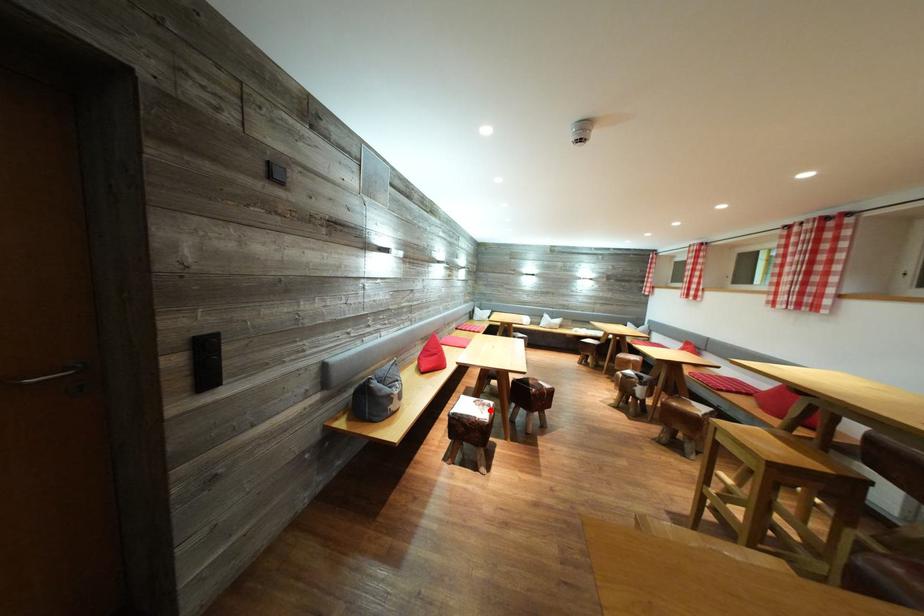
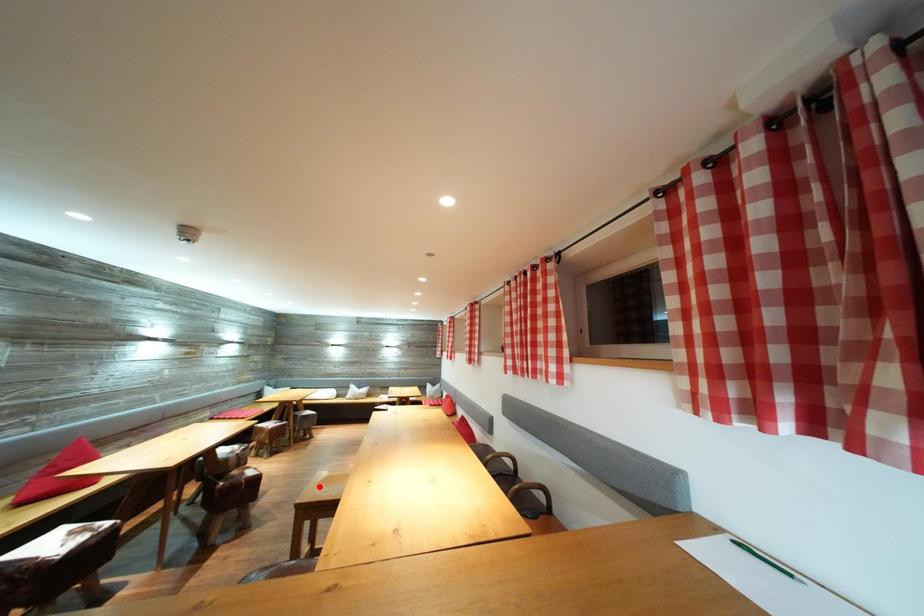
I am providing you with two images of the same scene from different viewpoints. A red point is marked on the first image and another point is marked on the second image. Are the points marked in image1 and image2 representing the same 3D position?

No